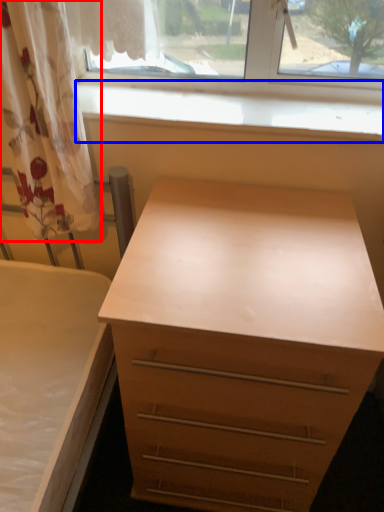
Question: Which object is further to the camera taking this photo, curtain (highlighted by a red box) or window sill (highlighted by a blue box)?

Choices:
 (A) curtain
 (B) window sill

Answer: (B)